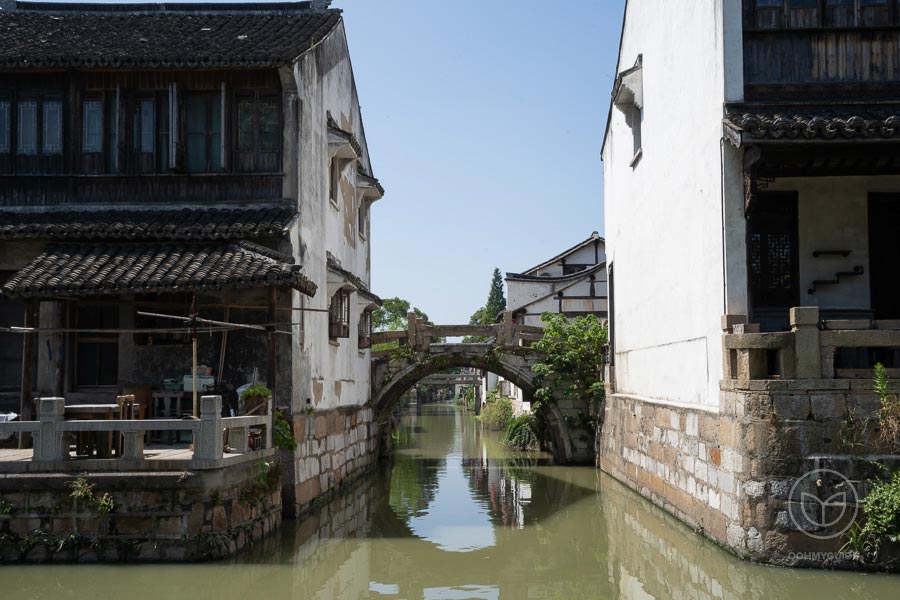
Locate an element on the screen. The height and width of the screenshot is (600, 900). arch way is located at coordinates (465, 364).